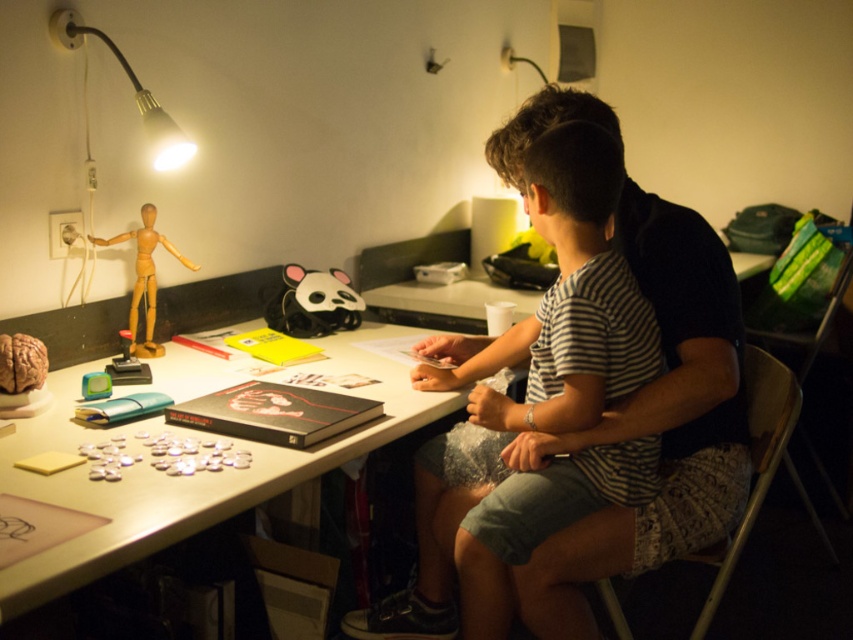
You are organizing items on a table and need to place the striped cotton shirt at center and the wooden mannequin at left. Which object requires more horizontal space to lay flat?

The striped cotton shirt at center requires more horizontal space to lay flat because its width surpasses that of the wooden mannequin at left.

In the scene shown: You are a photographer taking a closeup shot of the objects on the table. You want to focus on the point at coordinate point (395, 625) and point (340, 390). Which point should you adjust your camera focus to first if you want to focus on the one closer to the camera?

Point (340, 390) is closer to the camera than point (395, 625), so you should adjust your camera focus to point (340, 390) first.